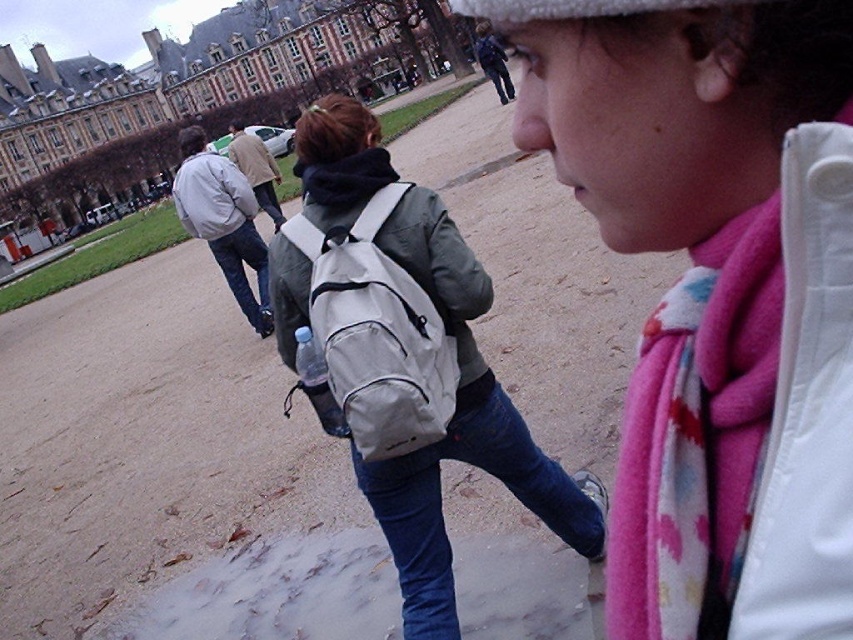
Does dirt field at center have a smaller size compared to pink fleece scarf at center-right?

No.

Locate an element on the screen. The image size is (853, 640). dirt field at center is located at coordinates (169, 470).

Between point (251, 376) and point (538, 134), which one is positioned in front?

Point (538, 134) is more forward.

Image resolution: width=853 pixels, height=640 pixels. In order to click on dirt field at center in this screenshot , I will do `click(169, 470)`.

Does brown stone building at upper left have a lesser height compared to matte gray jacket at center?

No, brown stone building at upper left is not shorter than matte gray jacket at center.

In order to click on brown stone building at upper left in this screenshot , I will do `click(229, 100)`.

Locate an element on the screen. This screenshot has width=853, height=640. brown stone building at upper left is located at coordinates (229, 100).

At what (x,y) coordinates should I click in order to perform the action: click on pink fleece scarf at center-right. Please return your answer as a coordinate pair (x, y). This screenshot has height=640, width=853. Looking at the image, I should click on (715, 292).